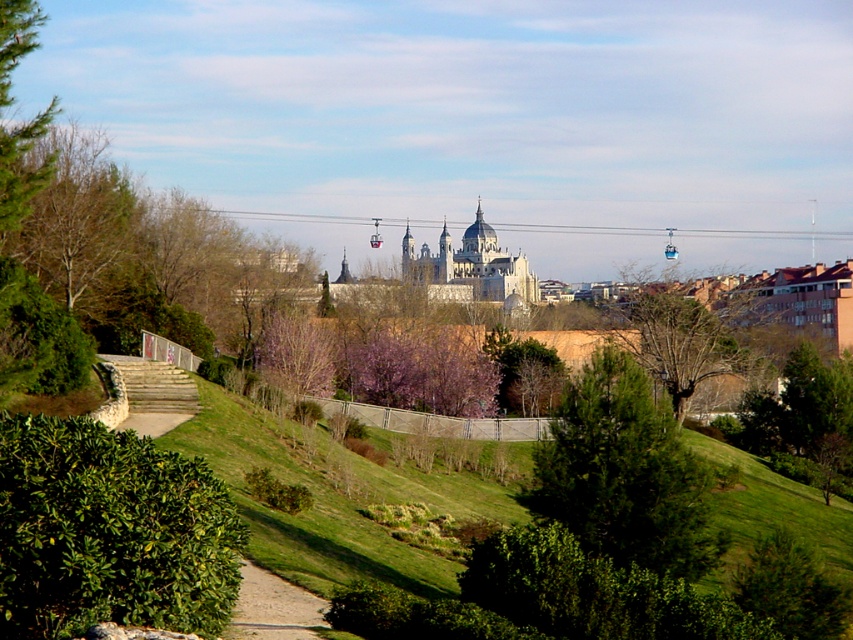
Question: Which is nearer to the green leafy bush at lower left?

Choices:
 (A) green needle-like at center
 (B) dirt/gravel path at lower center
 (C) pink textured tree at center

Answer: (B)

Question: From the image, what is the correct spatial relationship of green needle-like at center in relation to white stone castle at center?

Choices:
 (A) left
 (B) right

Answer: (B)

Question: Is green leafy bush at lower left smaller than white stone castle at center?

Choices:
 (A) no
 (B) yes

Answer: (B)

Question: Which point appears closest to the camera in this image?

Choices:
 (A) (171, 492)
 (B) (273, 636)
 (C) (309, 358)

Answer: (A)

Question: Which is farther from the dirt/gravel path at lower center?

Choices:
 (A) pink textured tree at center
 (B) green leafy bush at lower left

Answer: (A)

Question: Is green leafy bush at lower left to the right of white stone castle at center from the viewer's perspective?

Choices:
 (A) yes
 (B) no

Answer: (B)